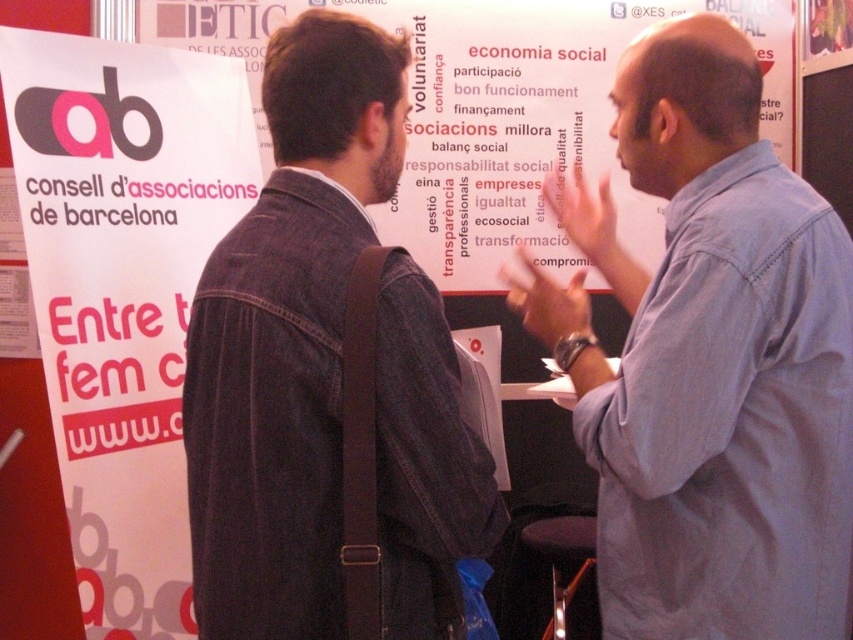
You are at an event booth and need to hand a document to the person wearing the denim jacket at center without disturbing the conversation. Since the white paper at upper center is in the way, where should you approach from?

You should approach from the left side of the denim jacket at center because the white paper at upper center is to the right of it, so approaching from the left would avoid blocking the conversation.

You are standing at the back of the event venue and want to approach the denim jacket at center and the white paper at upper center to take a photo. Which object should you move closer to first to ensure both are in frame?

You should move closer to the denim jacket at center first because it is closer to you than the white paper at upper center, so adjusting your position to include both would require focusing on the nearer object first.